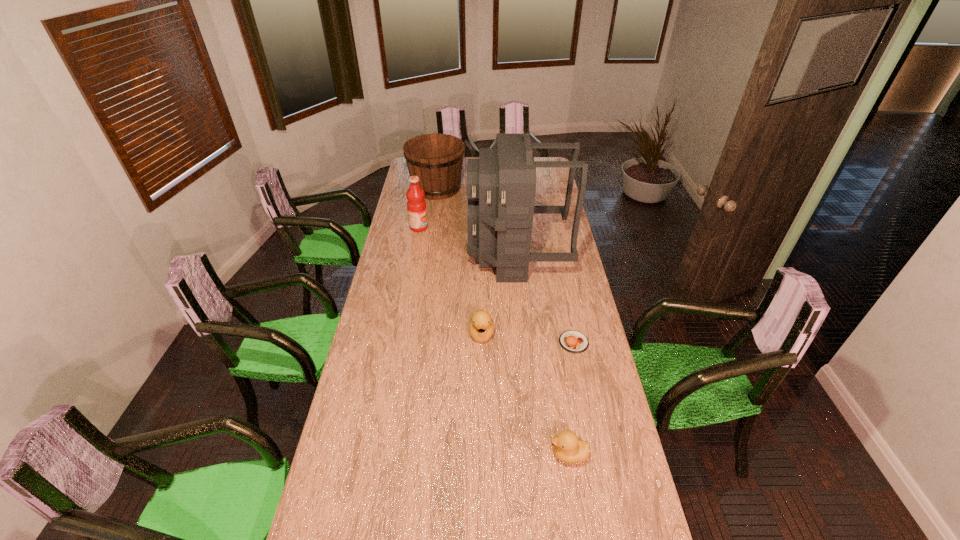
The width and height of the screenshot is (960, 540). In order to click on free space that satisfies the following two spatial constraints: 1. on the front compartment of the tallest object; 2. facing forward on the fourth tallest object in this screenshot , I will do `click(525, 334)`.

Locate an element on the screen. free space that satisfies the following two spatial constraints: 1. on the front compartment of the patty (food); 2. on the left side of the backpack is located at coordinates (526, 342).

This screenshot has height=540, width=960. I want to click on vacant space that satisfies the following two spatial constraints: 1. on the front side of the farthest object; 2. on the right side of the patty (food), so click(415, 342).

The width and height of the screenshot is (960, 540). Identify the location of vacant space that satisfies the following two spatial constraints: 1. on the back side of the patty (food); 2. on the front compartment of the tallest object. (556, 255).